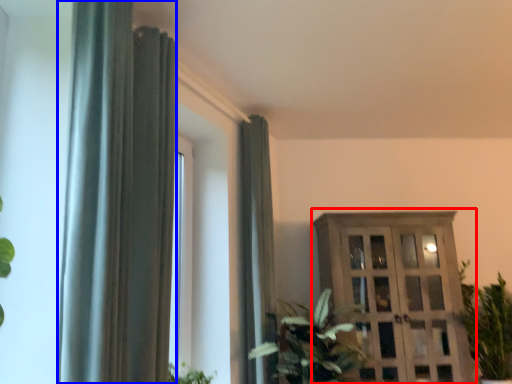
Question: Which object is further to the camera taking this photo, dresser (highlighted by a red box) or curtain (highlighted by a blue box)?

Choices:
 (A) dresser
 (B) curtain

Answer: (A)